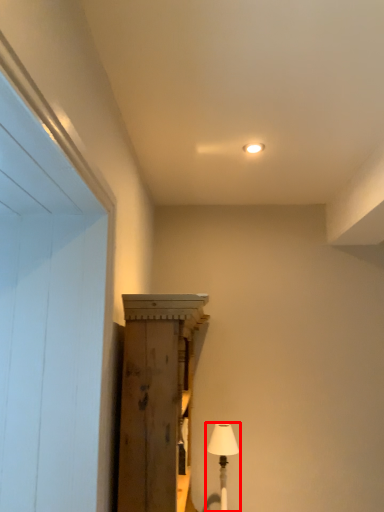
Question: From the image, what is the correct spatial relationship of table lamp (annotated by the red box) in relation to cabinetry?

Choices:
 (A) right
 (B) left

Answer: (A)